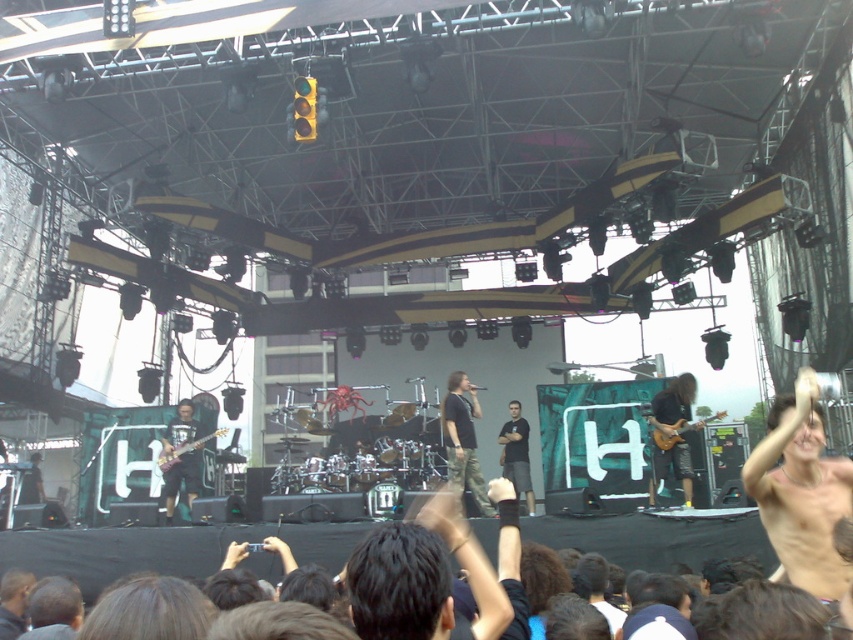
Is shiny black guitar at center shorter than black cotton shirt at center?

Yes, shiny black guitar at center is shorter than black cotton shirt at center.

At what (x,y) coordinates should I click in order to perform the action: click on shiny black guitar at center. Please return your answer as a coordinate pair (x, y). The width and height of the screenshot is (853, 640). Looking at the image, I should click on (181, 458).

At what (x,y) coordinates should I click in order to perform the action: click on shiny black guitar at center. Please return your answer as a coordinate pair (x, y). Looking at the image, I should click on (181, 458).

This screenshot has height=640, width=853. Describe the element at coordinates (463, 440) in the screenshot. I see `camouflage pants at center` at that location.

Who is positioned more to the right, camouflage pants at center or shiny black guitar at center?

Positioned to the right is camouflage pants at center.

You are a GUI agent. You are given a task and a screenshot of the screen. Output one action in this format:
    pyautogui.click(x=<x>, y=<y>)
    Task: Click on the camouflage pants at center
    The height and width of the screenshot is (640, 853).
    Given the screenshot: What is the action you would take?
    pyautogui.click(x=463, y=440)

Which is more to the right, camouflage pants at center or black cotton shirt at center?

black cotton shirt at center is more to the right.

Does point (465, 381) come behind point (505, 442)?

No.

You are a GUI agent. You are given a task and a screenshot of the screen. Output one action in this format:
    pyautogui.click(x=<x>, y=<y>)
    Task: Click on the camouflage pants at center
    
    Given the screenshot: What is the action you would take?
    pyautogui.click(x=463, y=440)